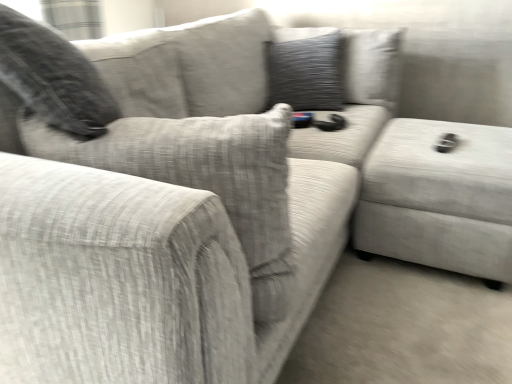
Question: From the image's perspective, is textured fabric ottoman at right located above or below textured gray pillow at upper center?

Choices:
 (A) above
 (B) below

Answer: (B)

Question: Is point (370, 238) closer or farther from the camera than point (295, 97)?

Choices:
 (A) farther
 (B) closer

Answer: (B)

Question: Is textured fabric ottoman at right taller or shorter than textured gray pillow at upper center?

Choices:
 (A) tall
 (B) short

Answer: (B)

Question: Does point (313, 61) appear closer or farther from the camera than point (425, 256)?

Choices:
 (A) farther
 (B) closer

Answer: (A)

Question: From the image's perspective, relative to textured fabric ottoman at right, is textured gray pillow at upper center above or below?

Choices:
 (A) below
 (B) above

Answer: (B)

Question: From a real-world perspective, relative to textured fabric ottoman at right, is textured gray pillow at upper center vertically above or below?

Choices:
 (A) below
 (B) above

Answer: (B)

Question: In the image, is textured gray pillow at upper center on the left side or the right side of textured fabric ottoman at right?

Choices:
 (A) left
 (B) right

Answer: (A)